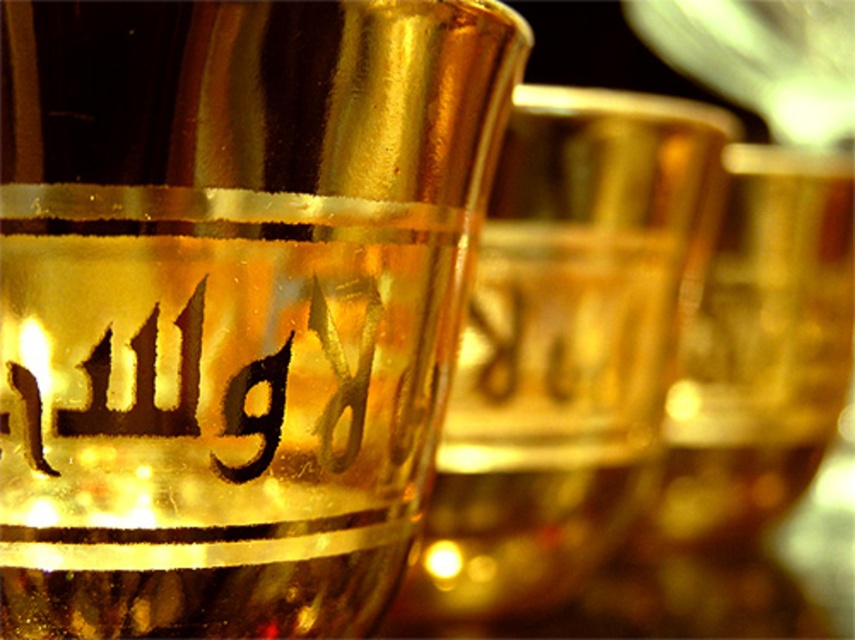
Is point (45, 10) positioned behind point (581, 445)?

No.

The height and width of the screenshot is (640, 855). Identify the location of shiny gold glass at center. (231, 301).